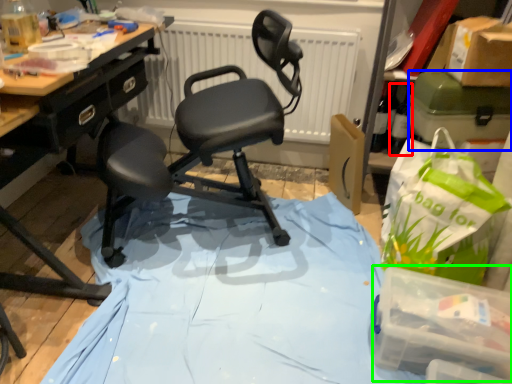
Question: Which object is positioned farthest from bottle (highlighted by a red box)? Select from box (highlighted by a blue box) and box (highlighted by a green box).

Choices:
 (A) box
 (B) box

Answer: (B)